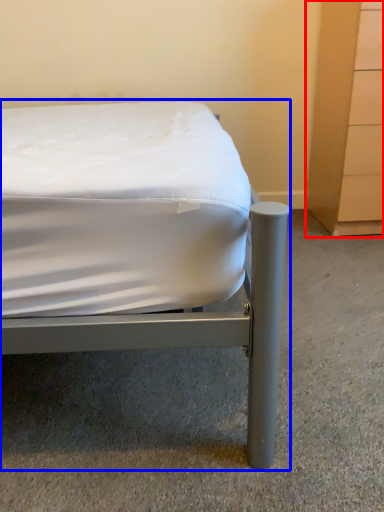
Question: Which of the following is the closest to the observer, dresser (highlighted by a red box) or bed (highlighted by a blue box)?

Choices:
 (A) dresser
 (B) bed

Answer: (B)